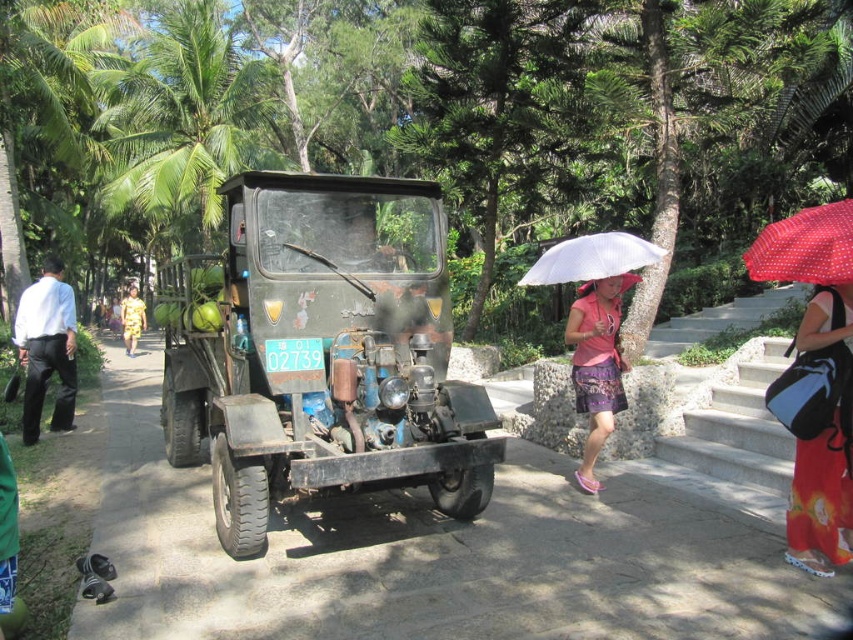
You are standing on the pathway in the tropical park scene. You see a floral cotton skirt at lower right and a pink fabric skirt at lower center. Which skirt is positioned more to the east?

The floral cotton skirt at lower right is positioned more to the east because it is to the right of the pink fabric skirt at lower center, and in the scene, the pathway runs from west to east.

You are a visitor in this tropical park and want to take a photo of the green leafy palm tree at upper left and the white matte umbrella at center. Which object should you focus on first if you want to capture both in a single frame without moving the camera?

The green leafy palm tree at upper left has a lesser height compared to the white matte matte umbrella at center, so you should focus on the taller white matte umbrella at center first to ensure both are in frame.